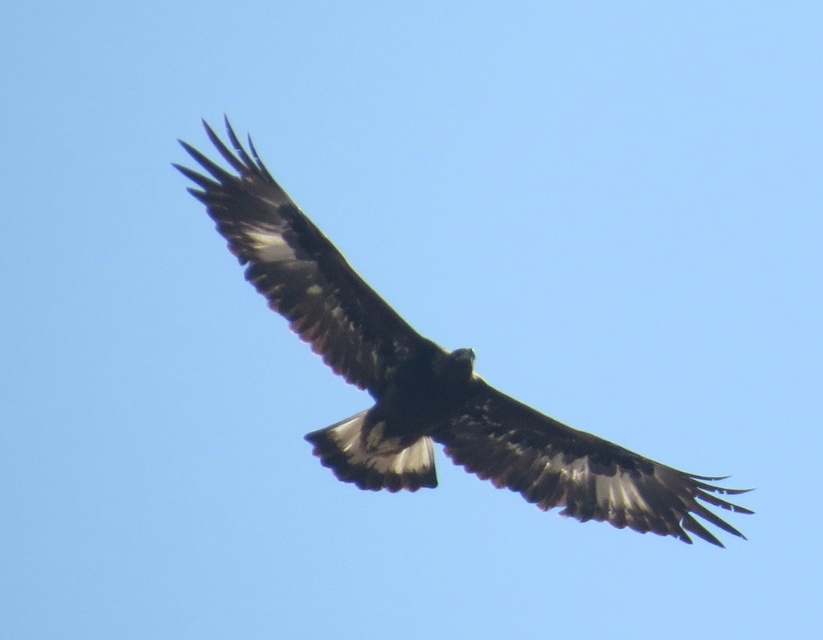
Question: Can you confirm if brown feathered wing at center is smaller than dark brown feathered wing at center?

Choices:
 (A) no
 (B) yes

Answer: (A)

Question: Is brown feathered eagle at center wider than dark brown feathered wing at center?

Choices:
 (A) no
 (B) yes

Answer: (B)

Question: Based on their relative distances, which object is farther from the brown feathered eagle at center?

Choices:
 (A) dark brown feathered wing at center
 (B) brown feathered wing at center

Answer: (B)

Question: Which of the following is the closest to the observer?

Choices:
 (A) (307, 246)
 (B) (518, 456)
 (C) (518, 464)

Answer: (A)

Question: Does brown feathered wing at center have a lesser width compared to dark brown feathered wing at center?

Choices:
 (A) no
 (B) yes

Answer: (B)

Question: Which point is closer to the camera taking this photo?

Choices:
 (A) (545, 468)
 (B) (275, 264)
 (C) (580, 461)

Answer: (B)